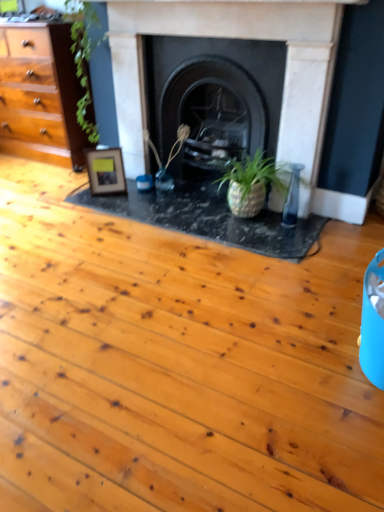
The image size is (384, 512). Identify the location of free space above marble fireplace at center, the second fireplace in the right-to-left sequence (from a real-world perspective). (226, 8).